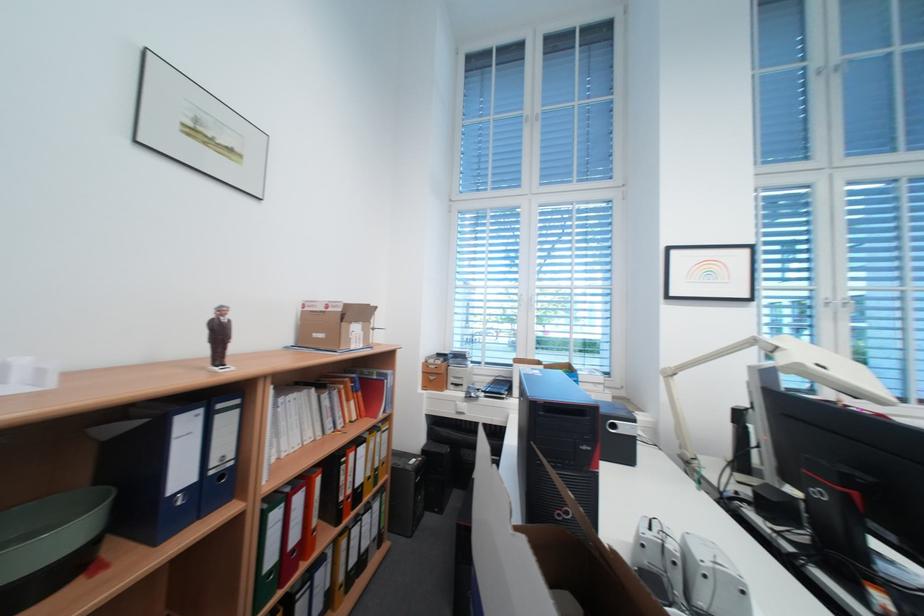
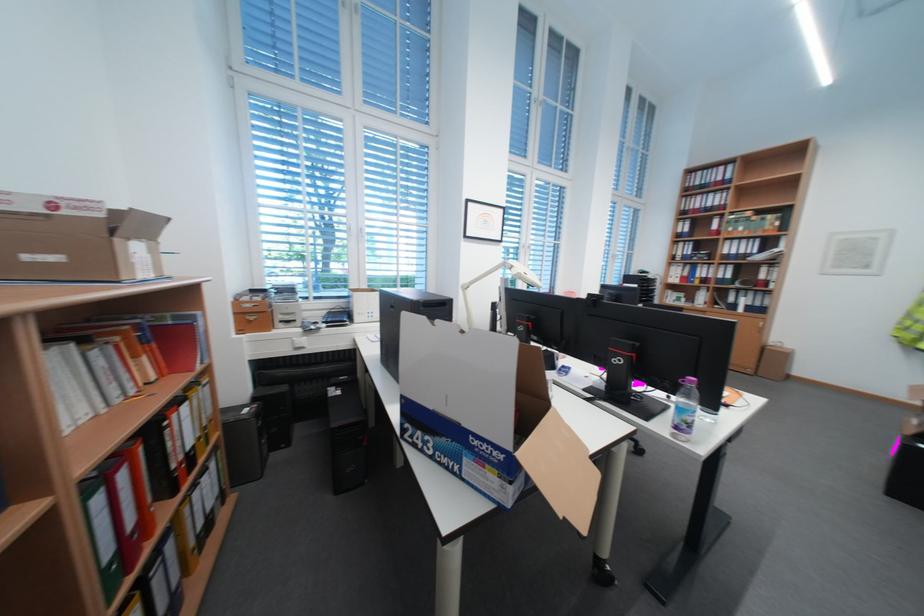
Question: The images are taken continuously from a first-person perspective. In which direction is your viewpoint rotating?

Choices:
 (A) Left
 (B) Right
 (C) Up
 (D) Down

Answer: (B)